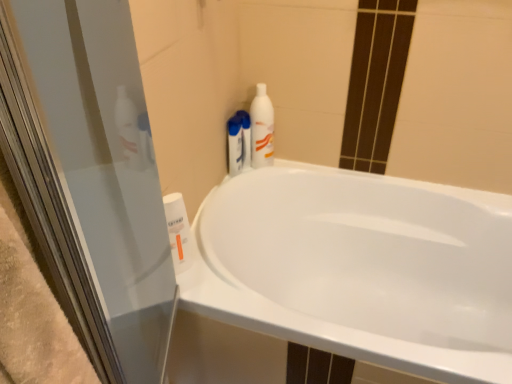
Find the location of a particular element. free location in front of white glossy bottle at upper right, the 1th cleaning product viewed from the back is located at coordinates (243, 187).